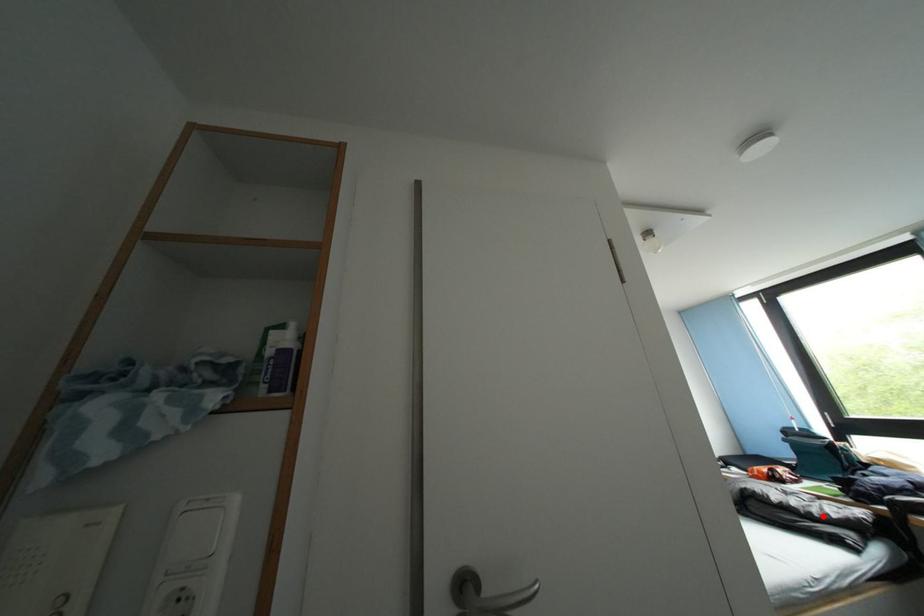
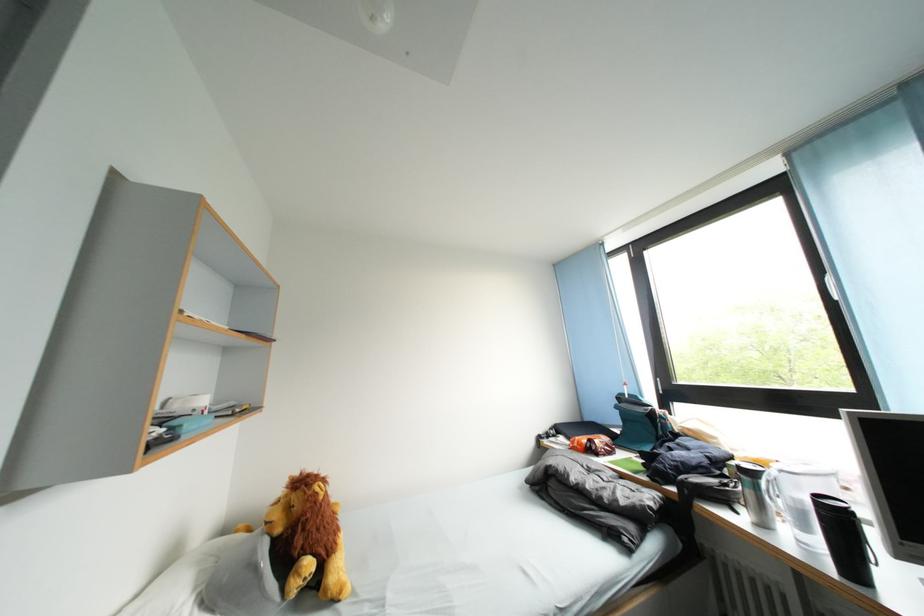
Question: I am providing you with two images of the same scene from different viewpoints. A red point is shown in image1. For the corresponding object point in image2, is it positioned nearer or farther from the camera?

Choices:
 (A) Nearer
 (B) Farther

Answer: (B)